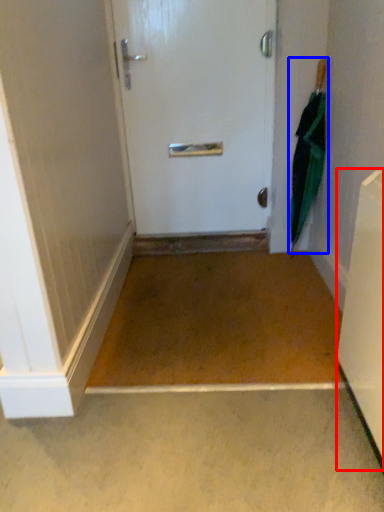
Question: Which point is closer to the camera, appliance (highlighted by a red box) or umbrella (highlighted by a blue box)?

Choices:
 (A) appliance
 (B) umbrella

Answer: (A)